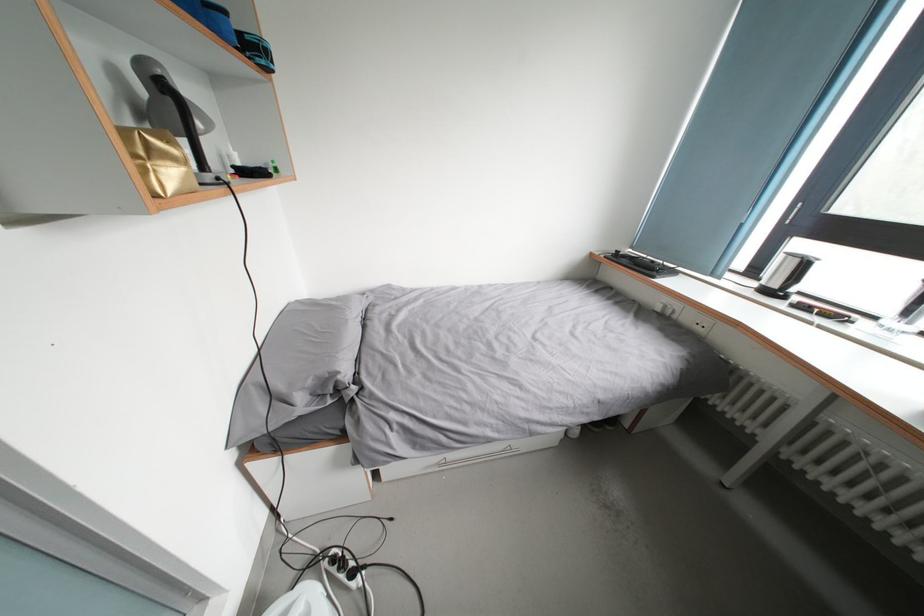
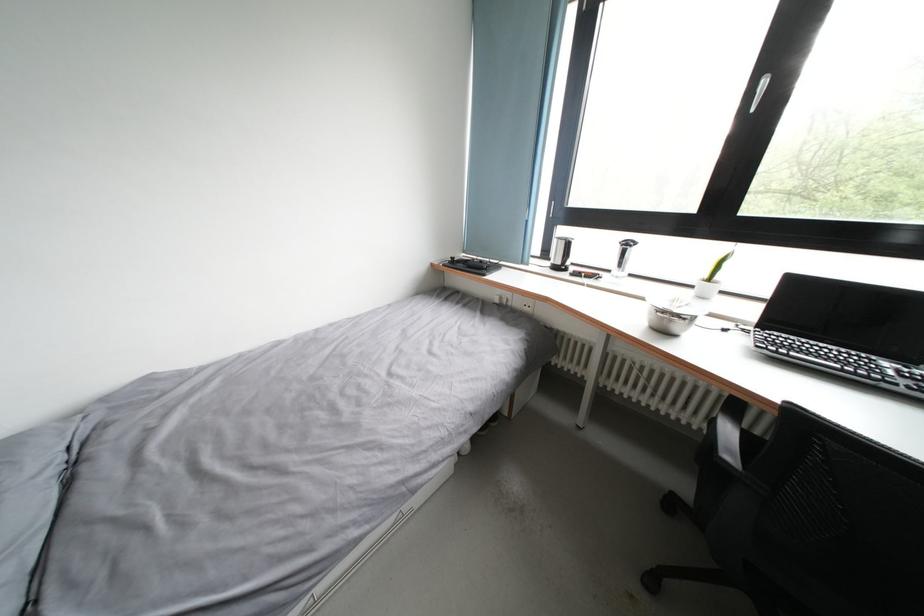
The point at [760,277] is marked in the first image. Where is the corresponding point in the second image?

(552, 259)